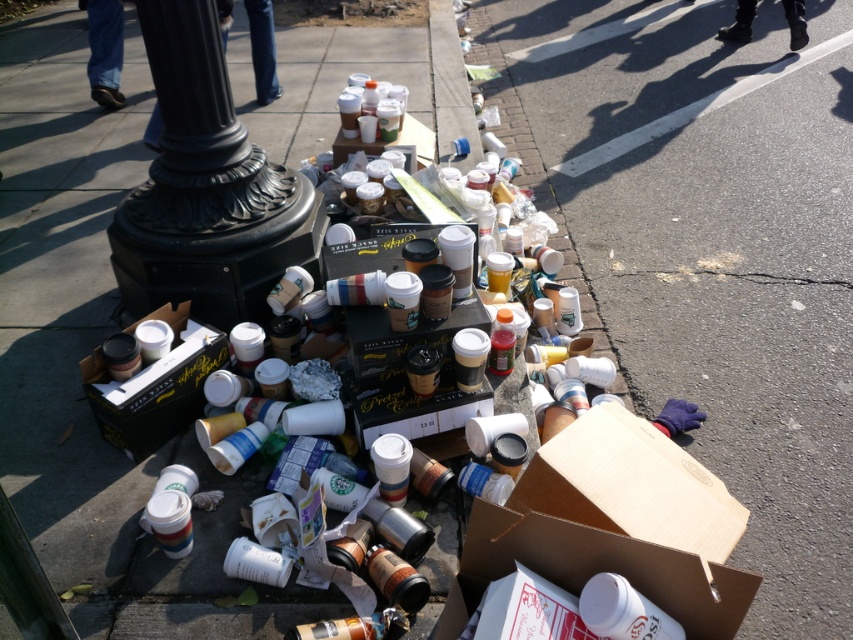
Question: Which object is positioned farthest from the black polished metal pole at lower left?

Choices:
 (A) matte cardboard box at center
 (B) cardboard box at lower center

Answer: (B)

Question: Considering the real-world distances, which object is closest to the matte black box at lower left?

Choices:
 (A) cardboard box at lower center
 (B) matte cardboard box at center
 (C) cardboard box at lower right
 (D) black polished metal pole at lower left

Answer: (D)

Question: Considering the real-world distances, which object is closest to the cardboard box at lower right?

Choices:
 (A) black polished metal pole at lower left
 (B) cardboard box at lower center
 (C) matte cardboard box at center

Answer: (B)

Question: Does black polished metal pole at lower left have a larger size compared to matte cardboard box at center?

Choices:
 (A) yes
 (B) no

Answer: (A)

Question: Is cardboard box at lower right above cardboard box at lower center?

Choices:
 (A) yes
 (B) no

Answer: (A)

Question: Can you confirm if matte black box at lower left is smaller than matte cardboard box at center?

Choices:
 (A) yes
 (B) no

Answer: (A)